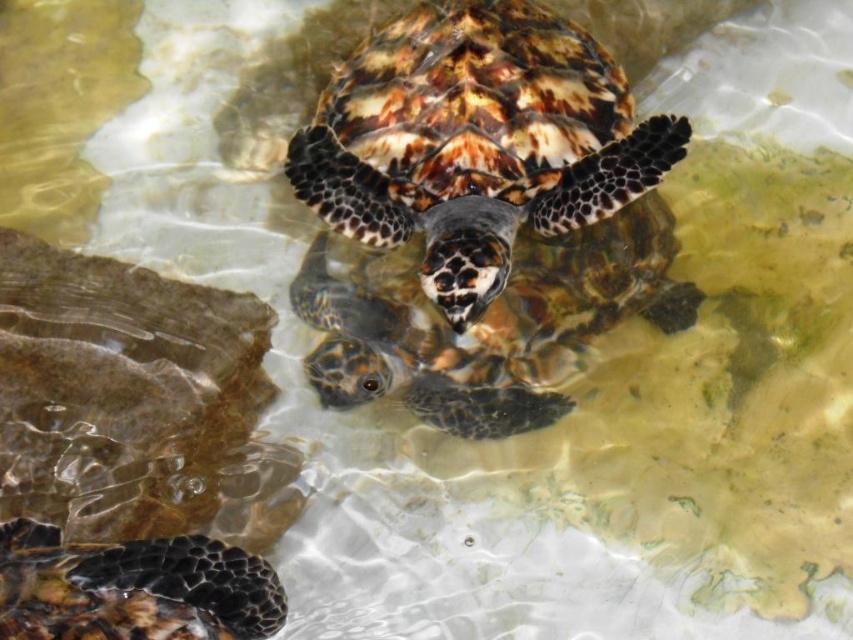
From the picture: You are a marine biologist observing the turtle in the water. You notice two features on the turtle at the center. Which one is taller, the leopard print shell at center or the leathery brown tortoise at center?

The leopard print shell at center is taller than the leathery brown tortoise at center according to the description.

You are observing a turtle in a tank. You see the patterned shell at lower left and the leathery brown tortoise at center. Which object is positioned to the left of the other?

The patterned shell at lower left is to the left of the leathery brown tortoise at center.